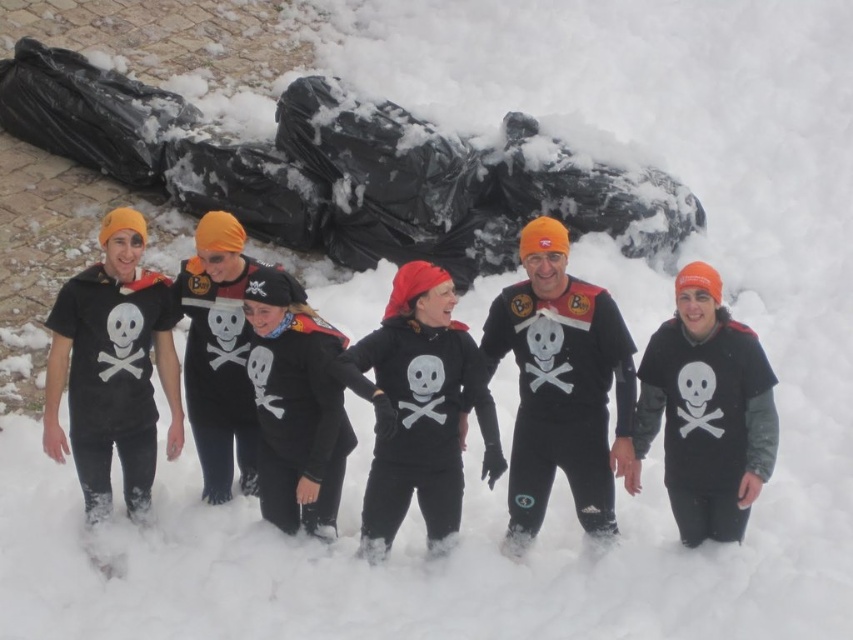
Is matte black t-shirt at left further to the viewer compared to black matte sweatshirt at center?

Yes, matte black t-shirt at left is further from the viewer.

Between point (137, 465) and point (492, 467), which one is positioned in front?

Point (492, 467) is more forward.

Is point (137, 387) in front of point (430, 397)?

No, (137, 387) is behind (430, 397).

The image size is (853, 640). What are the coordinates of `matte black t-shirt at left` in the screenshot? It's located at (112, 369).

Who is positioned more to the right, matte black t-shirt at left or matte black shirt at center?

matte black shirt at center

Is matte black t-shirt at left below matte black shirt at center?

Incorrect, matte black t-shirt at left is not positioned below matte black shirt at center.

Describe the element at coordinates (112, 369) in the screenshot. I see `matte black t-shirt at left` at that location.

The height and width of the screenshot is (640, 853). Identify the location of matte black t-shirt at left. (112, 369).

Describe the element at coordinates (561, 387) in the screenshot. This screenshot has width=853, height=640. I see `matte black wetsuit at center` at that location.

Which is in front, point (573, 490) or point (405, 317)?

Point (405, 317) is more forward.

Where is `matte black wetsuit at center`? matte black wetsuit at center is located at coordinates (561, 387).